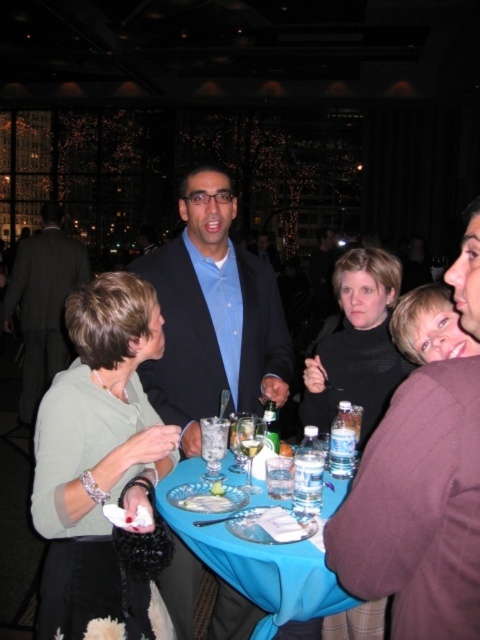
From the picture: Is blue fabric table at center wider than black knit sweater at center?

Yes, blue fabric table at center is wider than black knit sweater at center.

Does blue fabric table at center appear under black knit sweater at center?

Correct, blue fabric table at center is located below black knit sweater at center.

I want to click on blue fabric table at center, so click(255, 563).

Who is shorter, blue shirt at center or translucent plastic water at table center?

translucent plastic water at table center is shorter.

Is point (211, 257) positioned in front of point (316, 488)?

No, (211, 257) is further to viewer.

What do you see at coordinates (213, 316) in the screenshot? I see `blue shirt at center` at bounding box center [213, 316].

Where is `blue shirt at center`? blue shirt at center is located at coordinates (213, 316).

Between white porcelain bowl at table center and clear glass at table center, which one appears on the left side from the viewer's perspective?

white porcelain bowl at table center

Which is in front, point (199, 502) or point (260, 445)?

Point (199, 502)

This screenshot has width=480, height=640. What are the coordinates of `white porcelain bowl at table center` in the screenshot? It's located at 205,502.

The width and height of the screenshot is (480, 640). Find the location of `white porcelain bowl at table center`. white porcelain bowl at table center is located at coordinates (205, 502).